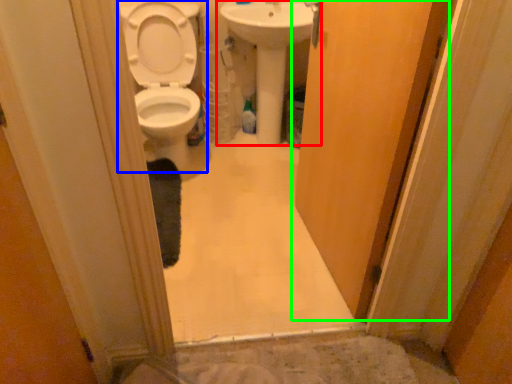
Question: Which is nearer to the sink (highlighted by a red box)? toilet (highlighted by a blue box) or door (highlighted by a green box).

Choices:
 (A) toilet
 (B) door

Answer: (A)